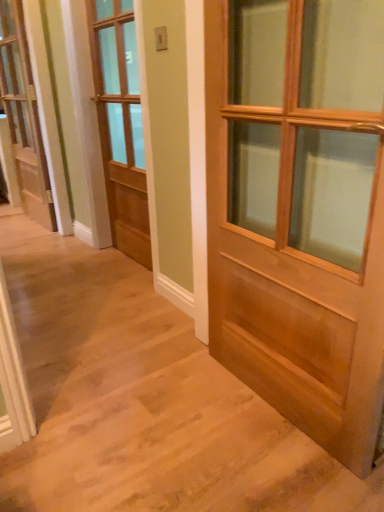
Question: In terms of size, does light brown wooden door at center, placed as the first door when sorted from front to back, appear bigger or smaller than white painted wood door at left, positioned as the 3th door in right-to-left order?

Choices:
 (A) big
 (B) small

Answer: (A)

Question: Considering their positions, is light brown wooden door at center, marked as the third door in a back-to-front arrangement, located in front of or behind white painted wood door at left, placed as the third door when sorted from front to back?

Choices:
 (A) front
 (B) behind

Answer: (A)

Question: Estimate the real-world distances between objects in this image. Which object is farther from the white painted wood door at left, the 1th door from the left?

Choices:
 (A) light brown wooden door at center, placed as the third door when sorted from left to right
 (B) light brown wood door at center, the 2th door from the left

Answer: (A)

Question: Based on their relative distances, which object is nearer to the light brown wooden door at center, the 1th door in the right-to-left sequence?

Choices:
 (A) light brown wood door at center, acting as the 2th door starting from the back
 (B) white painted wood door at left, placed as the third door when sorted from front to back

Answer: (A)